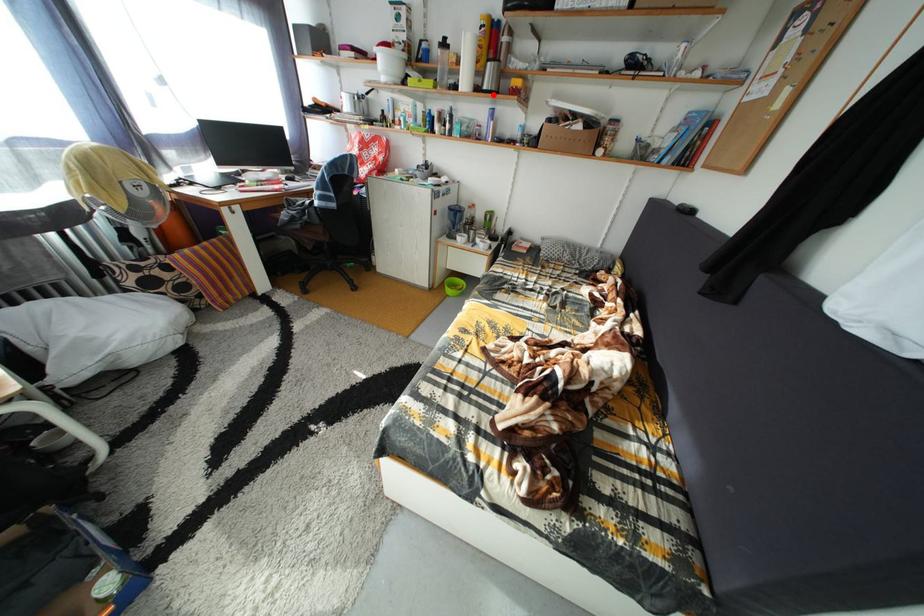
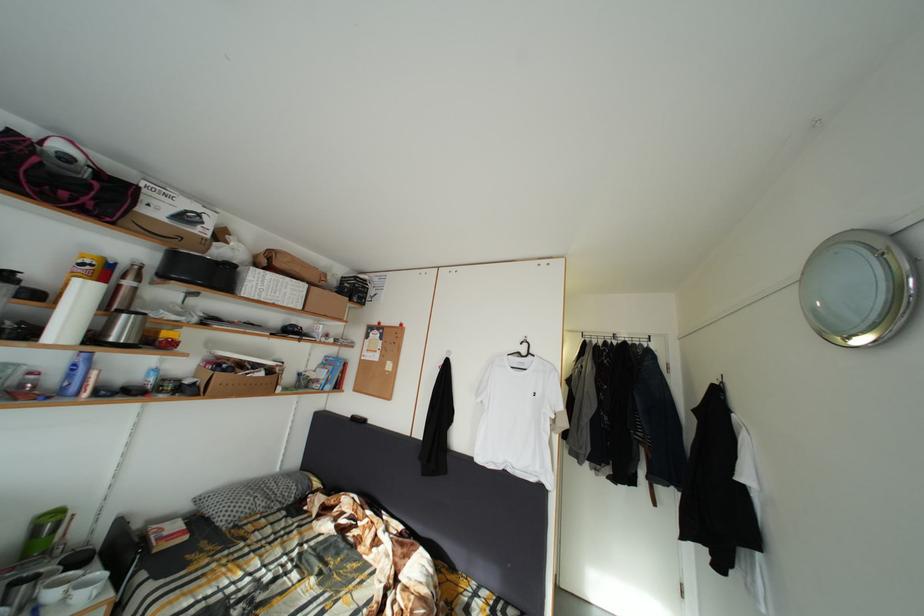
The point at the highlighted location is marked in the first image. Where is the corresponding point in the second image?

(120, 345)